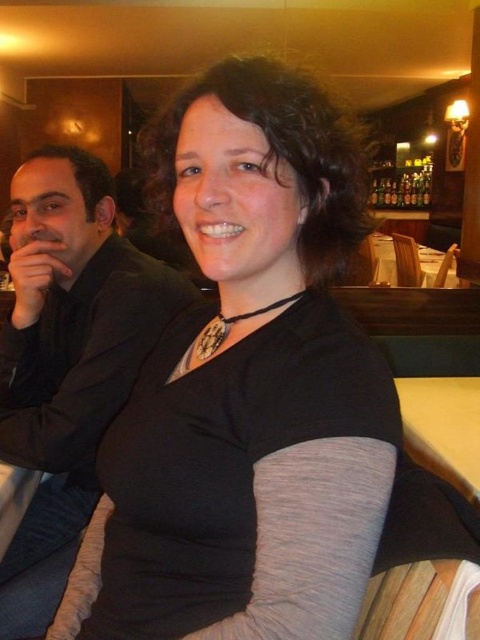
You are a photographer setting up for a photoshoot in this scene. You need to place a large equipment bag that requires more space than the black matte suit at left. Where should you place it so it doesn t block the yellow wood table at center?

Since the black matte suit at left is bigger than the yellow wood table at center, you should place the large equipment bag near the black matte suit at left as it has more space available without blocking the yellow wood table at center.